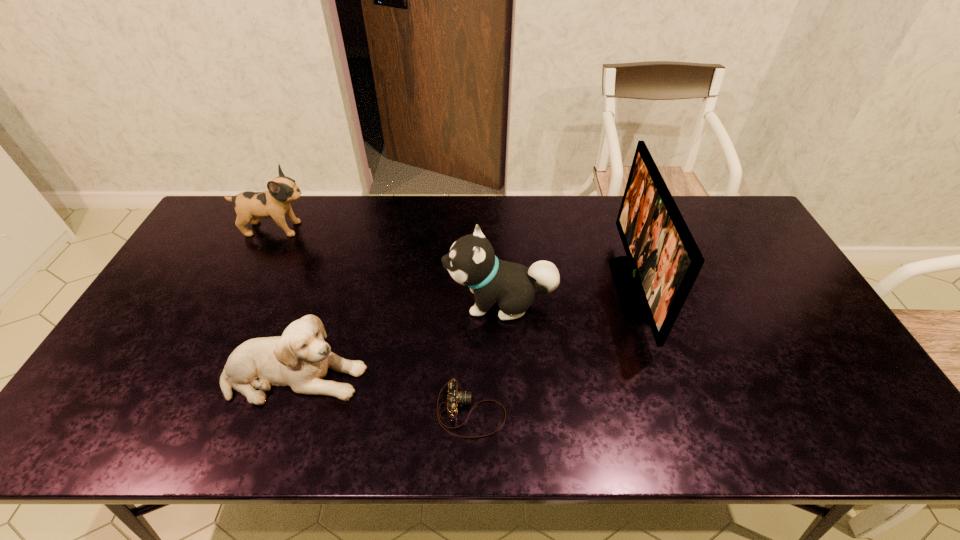
Locate an element on the screen. The image size is (960, 540). the tallest object is located at coordinates (663, 260).

At what (x,y) coordinates should I click in order to perform the action: click on the rightmost object. Please return your answer as a coordinate pair (x, y). The height and width of the screenshot is (540, 960). Looking at the image, I should click on (663, 260).

Where is `the second farthest puppy`? The width and height of the screenshot is (960, 540). the second farthest puppy is located at coordinates (471, 261).

Where is `the farthest puppy`? the farthest puppy is located at coordinates (250, 206).

At what (x,y) coordinates should I click in order to perform the action: click on the second shortest object. Please return your answer as a coordinate pair (x, y). The image size is (960, 540). Looking at the image, I should click on (300, 358).

What are the coordinates of `the nearest puppy` in the screenshot? It's located at (300, 358).

This screenshot has height=540, width=960. Find the location of `camera`. camera is located at coordinates coord(455,397).

Image resolution: width=960 pixels, height=540 pixels. Find the location of `vacant space located on the front-facing side of the rightmost object`. vacant space located on the front-facing side of the rightmost object is located at coordinates (536, 289).

Where is `vacant space located on the front-facing side of the rightmost object`? Image resolution: width=960 pixels, height=540 pixels. vacant space located on the front-facing side of the rightmost object is located at coordinates (569, 289).

Identify the location of blank space located on the front-facing side of the rightmost object. (549, 289).